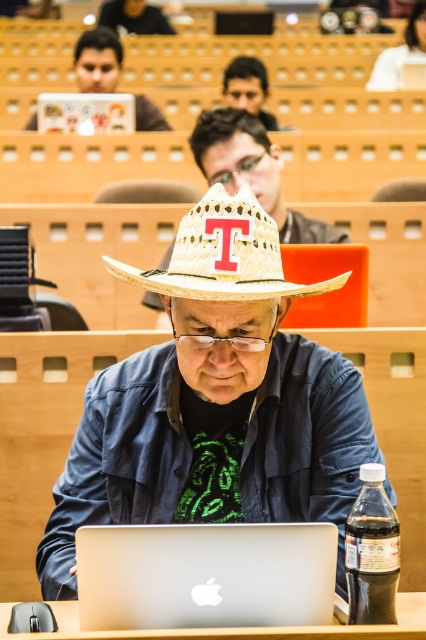
In the scene shown: You are a student sitting at the desk in the lecture hall. You need to place your notebook on the desk so that it is between the straw hat at center and the silver metallic table at lower center. Is this possible?

The straw hat at center is to the right of the silver metallic table at lower center, so placing the notebook between them would require placing it on the desk between the two objects.

Looking at this image, you are a student in the lecture hall and need to borrow a laptop charger. The silver metallic laptop at center belongs to the professor, and the matte black laptop at upper left is yours. To avoid disturbing him, which laptop should you approach?

You should approach the matte black laptop at upper left because it is located at upper left, which is closer to you than the silver metallic laptop at center that belongs to the professor.